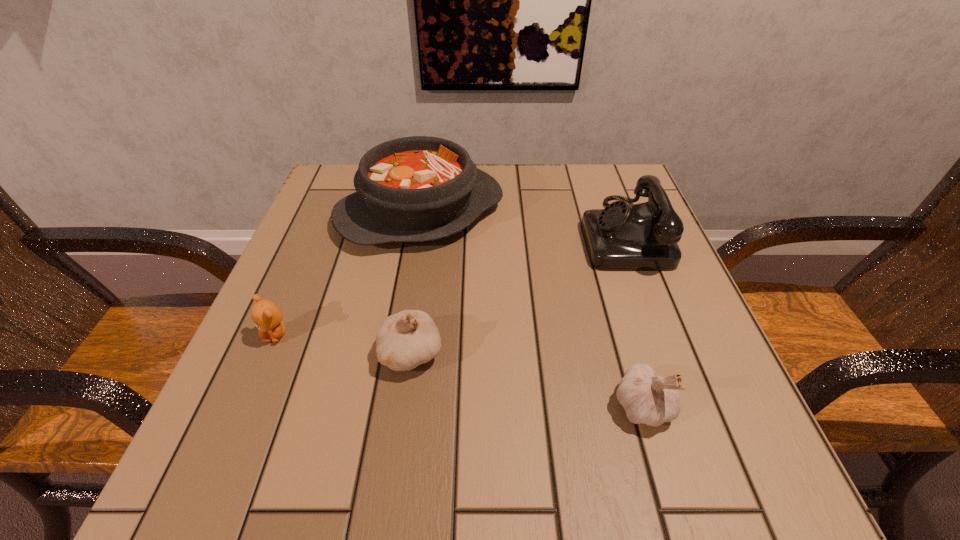
Identify the location of vacant space located on the back of the right garlic. Image resolution: width=960 pixels, height=540 pixels. (590, 227).

In order to click on vacant region located on the back of the left garlic in this screenshot , I will do `click(427, 240)`.

Find the location of a particular element. blank space located on the face of the teddy bear is located at coordinates (211, 488).

Identify the location of casserole located in the far edge section of the desktop. The width and height of the screenshot is (960, 540). (412, 189).

Locate an element on the screen. This screenshot has width=960, height=540. telephone that is at the far edge is located at coordinates (641, 237).

Identify the location of casserole positioned at the left edge. (412, 189).

The height and width of the screenshot is (540, 960). Find the location of `teddy bear present at the left edge`. teddy bear present at the left edge is located at coordinates (266, 315).

Identify the location of telephone that is positioned at the right edge. Image resolution: width=960 pixels, height=540 pixels. (641, 237).

Find the location of `garlic located in the right edge section of the desktop`. garlic located in the right edge section of the desktop is located at coordinates (648, 399).

Image resolution: width=960 pixels, height=540 pixels. In order to click on object that is positioned at the far left corner in this screenshot , I will do `click(412, 189)`.